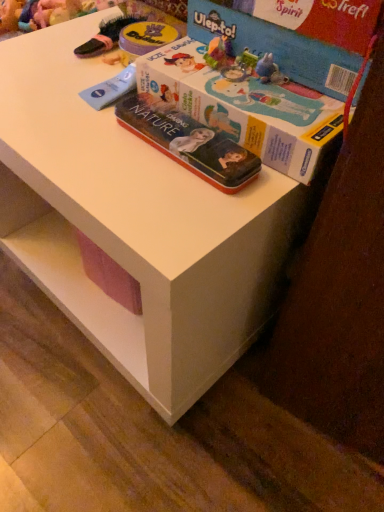
What do you see at coordinates (245, 106) in the screenshot? The image size is (384, 512). I see `blue cardboard box at upper right, which is counted as the 2th box, starting from the top` at bounding box center [245, 106].

How much space does blue cardboard box at upper right, marked as the first box in a bottom-to-top arrangement, occupy horizontally?

blue cardboard box at upper right, marked as the first box in a bottom-to-top arrangement, is 12.96 inches in width.

Locate an element on the screen. The height and width of the screenshot is (512, 384). cardboard box at upper right, the first box viewed from the top is located at coordinates (295, 36).

Find the location of `metallic tin box at center`. metallic tin box at center is located at coordinates (188, 142).

You are a GUI agent. You are given a task and a screenshot of the screen. Output one action in this format:
    pyautogui.click(x=<x>, y=<y>)
    Task: Click on the blue cardboard box at upper right, which is counted as the 2th box, starting from the top
    
    Given the screenshot: What is the action you would take?
    pyautogui.click(x=245, y=106)

Considering the positions of point (286, 67) and point (150, 52), is point (286, 67) closer or farther from the camera than point (150, 52)?

Clearly, point (286, 67) is closer to the camera than point (150, 52).

Is cardboard box at upper right, the first box viewed from the top, located outside blue cardboard box at upper right, marked as the first box in a bottom-to-top arrangement?

Absolutely, cardboard box at upper right, the first box viewed from the top, is external to blue cardboard box at upper right, marked as the first box in a bottom-to-top arrangement.

Looking at the image, does cardboard box at upper right, placed as the 2th box when sorted from bottom to top, seem bigger or smaller compared to blue cardboard box at upper right, marked as the first box in a bottom-to-top arrangement?

cardboard box at upper right, placed as the 2th box when sorted from bottom to top, is smaller than blue cardboard box at upper right, marked as the first box in a bottom-to-top arrangement.

Considering the positions of objects blue cardboard box at upper right, which is counted as the 2th box, starting from the top, and metallic tin box at center in the image provided, who is more to the right, blue cardboard box at upper right, which is counted as the 2th box, starting from the top, or metallic tin box at center?

From the viewer's perspective, blue cardboard box at upper right, which is counted as the 2th box, starting from the top, appears more on the right side.

Identify the location of box that is the 1st object above the metallic tin box at center (from a real-world perspective). (245, 106).

From the image's perspective, does blue cardboard box at upper right, marked as the first box in a bottom-to-top arrangement, appear higher than metallic tin box at center?

Yes.

Is blue cardboard box at upper right, marked as the first box in a bottom-to-top arrangement, shorter than metallic tin box at center?

In fact, blue cardboard box at upper right, marked as the first box in a bottom-to-top arrangement, may be taller than metallic tin box at center.

Which of these two, cardboard box at upper right, placed as the 2th box when sorted from bottom to top, or metallic tin box at center, is bigger?

With larger size is cardboard box at upper right, placed as the 2th box when sorted from bottom to top.

Is cardboard box at upper right, the first box viewed from the top, facing towards metallic tin box at center?

No.

Considering the relative sizes of cardboard box at upper right, the first box viewed from the top, and metallic tin box at center in the image provided, is cardboard box at upper right, the first box viewed from the top, thinner than metallic tin box at center?

Incorrect, the width of cardboard box at upper right, the first box viewed from the top, is not less than that of metallic tin box at center.

Find the location of a particular element. box below the cardboard box at upper right, the first box viewed from the top (from a real-world perspective) is located at coordinates (245, 106).

Is blue cardboard box at upper right, which is counted as the 2th box, starting from the top, positioned with its back to cardboard box at upper right, placed as the 2th box when sorted from bottom to top?

No, blue cardboard box at upper right, which is counted as the 2th box, starting from the top, is not facing the opposite direction of cardboard box at upper right, placed as the 2th box when sorted from bottom to top.

Between blue cardboard box at upper right, which is counted as the 2th box, starting from the top, and cardboard box at upper right, the first box viewed from the top, which one has smaller width?

With smaller width is cardboard box at upper right, the first box viewed from the top.

From the image's perspective, is blue cardboard box at upper right, marked as the first box in a bottom-to-top arrangement, located beneath cardboard box at upper right, the first box viewed from the top?

Correct, blue cardboard box at upper right, marked as the first box in a bottom-to-top arrangement, appears lower than cardboard box at upper right, the first box viewed from the top, in the image.

Which point is more forward, (130, 99) or (281, 120)?

Positioned in front is point (281, 120).

Considering the positions of objects metallic tin box at center and blue cardboard box at upper right, which is counted as the 2th box, starting from the top, in the image provided, who is more to the left, metallic tin box at center or blue cardboard box at upper right, which is counted as the 2th box, starting from the top,?

metallic tin box at center is more to the left.

Which of these two, metallic tin box at center or blue cardboard box at upper right, marked as the first box in a bottom-to-top arrangement, is thinner?

Thinner between the two is metallic tin box at center.

Is metallic tin box at center in contact with blue cardboard box at upper right, marked as the first box in a bottom-to-top arrangement?

Yes.

Is metallic tin box at center located outside cardboard box at upper right, placed as the 2th box when sorted from bottom to top?

metallic tin box at center lies outside cardboard box at upper right, placed as the 2th box when sorted from bottom to top,'s area.

Who is taller, metallic tin box at center or cardboard box at upper right, the first box viewed from the top?

Standing taller between the two is cardboard box at upper right, the first box viewed from the top.

Could you tell me if metallic tin box at center is turned towards cardboard box at upper right, placed as the 2th box when sorted from bottom to top?

No, metallic tin box at center is not turned towards cardboard box at upper right, placed as the 2th box when sorted from bottom to top.

Where is `box beneath the cardboard box at upper right, the first box viewed from the top (from a real-world perspective)`? The width and height of the screenshot is (384, 512). box beneath the cardboard box at upper right, the first box viewed from the top (from a real-world perspective) is located at coordinates (245, 106).

This screenshot has height=512, width=384. Find the location of `the 2nd box in front of the metallic tin box at center, counting from the anchor's position`. the 2nd box in front of the metallic tin box at center, counting from the anchor's position is located at coordinates (245, 106).

Considering their positions, is cardboard box at upper right, placed as the 2th box when sorted from bottom to top, positioned further to blue cardboard box at upper right, which is counted as the 2th box, starting from the top, than metallic tin box at center?

cardboard box at upper right, placed as the 2th box when sorted from bottom to top.

Considering their positions, is blue cardboard box at upper right, marked as the first box in a bottom-to-top arrangement, positioned further to metallic tin box at center than cardboard box at upper right, placed as the 2th box when sorted from bottom to top?

Based on the image, cardboard box at upper right, placed as the 2th box when sorted from bottom to top, appears to be further to metallic tin box at center.

Looking at the image, which one is located closer to metallic tin box at center, cardboard box at upper right, the first box viewed from the top, or blue cardboard box at upper right, which is counted as the 2th box, starting from the top?

blue cardboard box at upper right, which is counted as the 2th box, starting from the top, is closer to metallic tin box at center.

From the picture: Considering their positions, is blue cardboard box at upper right, marked as the first box in a bottom-to-top arrangement, positioned further to cardboard box at upper right, placed as the 2th box when sorted from bottom to top, than metallic tin box at center?

metallic tin box at center lies further to cardboard box at upper right, placed as the 2th box when sorted from bottom to top, than the other object.

Estimate the real-world distances between objects in this image. Which object is closer to cardboard box at upper right, placed as the 2th box when sorted from bottom to top, metallic tin box at center or blue cardboard box at upper right, marked as the first box in a bottom-to-top arrangement?

Among the two, blue cardboard box at upper right, marked as the first box in a bottom-to-top arrangement, is located nearer to cardboard box at upper right, placed as the 2th box when sorted from bottom to top.

Looking at the image, which one is located closer to blue cardboard box at upper right, marked as the first box in a bottom-to-top arrangement, metallic tin box at center or cardboard box at upper right, placed as the 2th box when sorted from bottom to top?

metallic tin box at center lies closer to blue cardboard box at upper right, marked as the first box in a bottom-to-top arrangement, than the other object.

Where is `box situated between metallic tin box at center and cardboard box at upper right, placed as the 2th box when sorted from bottom to top, from left to right`? box situated between metallic tin box at center and cardboard box at upper right, placed as the 2th box when sorted from bottom to top, from left to right is located at coordinates (245, 106).